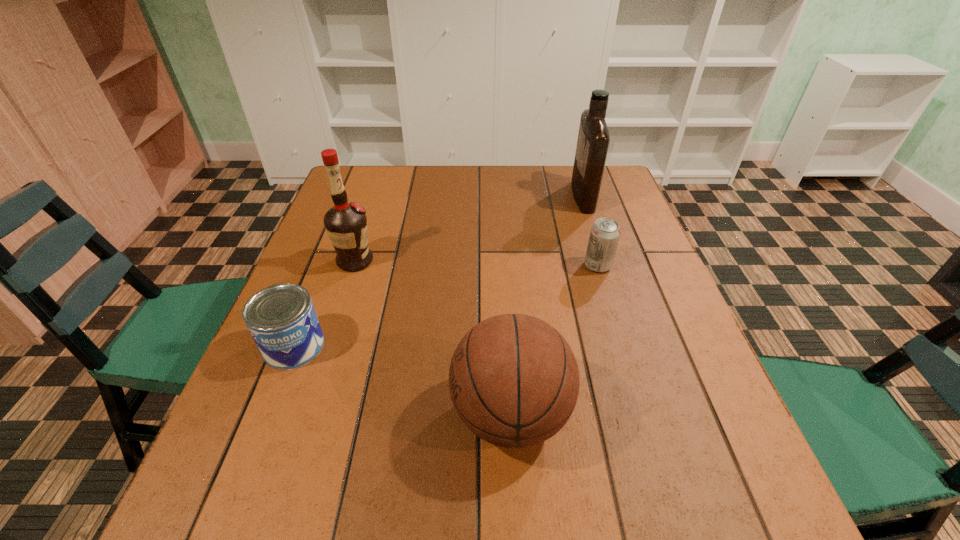
In order to click on vacant space that satisfies the following two spatial constraints: 1. on the front and back of the left liquor; 2. on the front label of the can in this screenshot , I will do `click(327, 346)`.

Image resolution: width=960 pixels, height=540 pixels. Identify the location of vacant point that satisfies the following two spatial constraints: 1. on the front and back of the left liquor; 2. on the front label of the can. (327, 346).

Where is `vacant point that satisfies the following two spatial constraints: 1. on the front and back of the nearer liquor; 2. on the front label of the can`? vacant point that satisfies the following two spatial constraints: 1. on the front and back of the nearer liquor; 2. on the front label of the can is located at coordinates (327, 346).